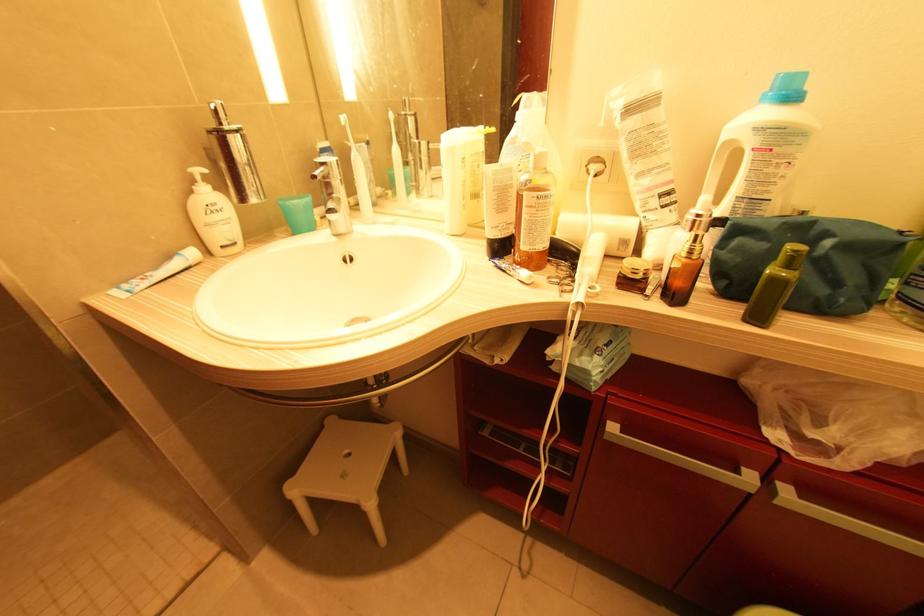
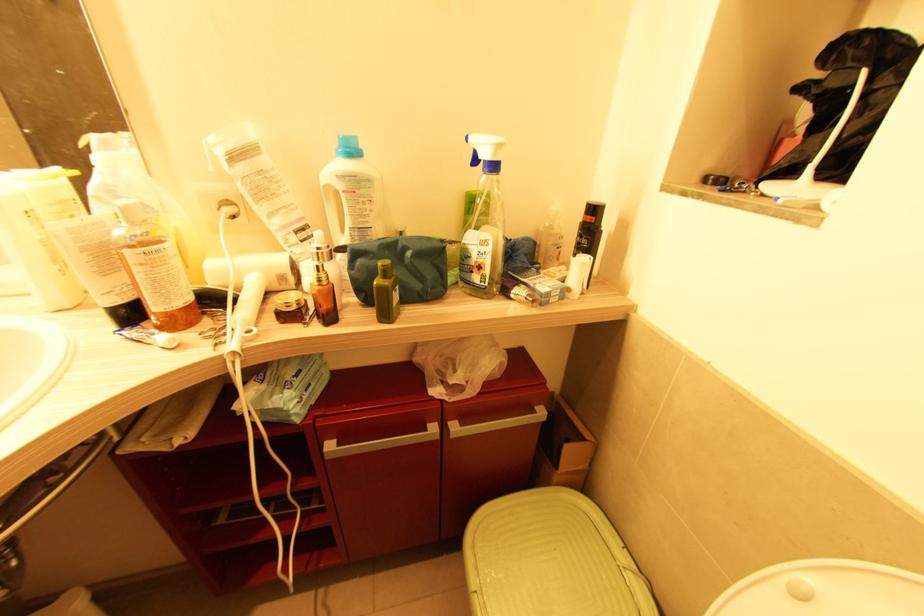
The point at (789, 267) is marked in the first image. Where is the corresponding point in the second image?

(386, 278)